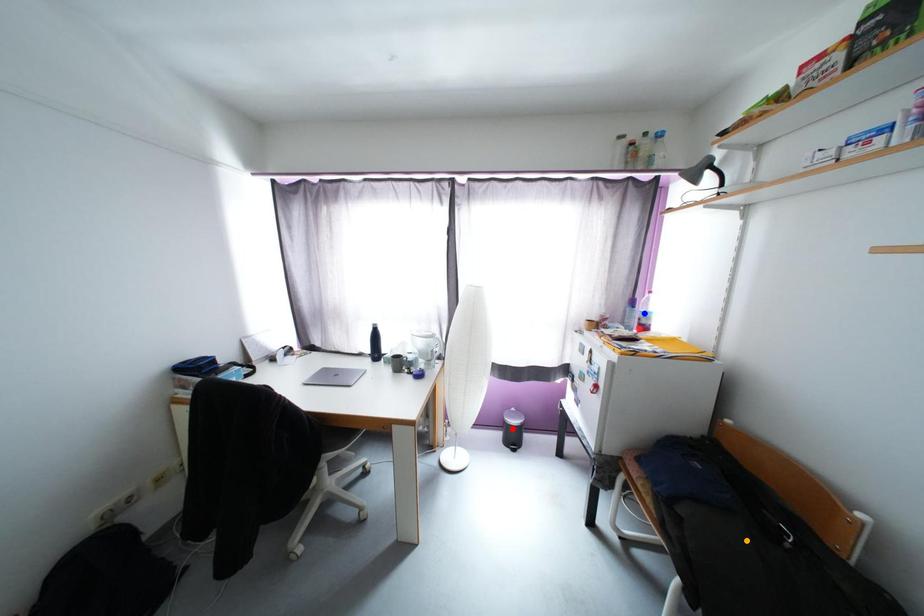
Order these from nearest to farthest:
- orange point
- blue point
- red point

orange point, blue point, red point